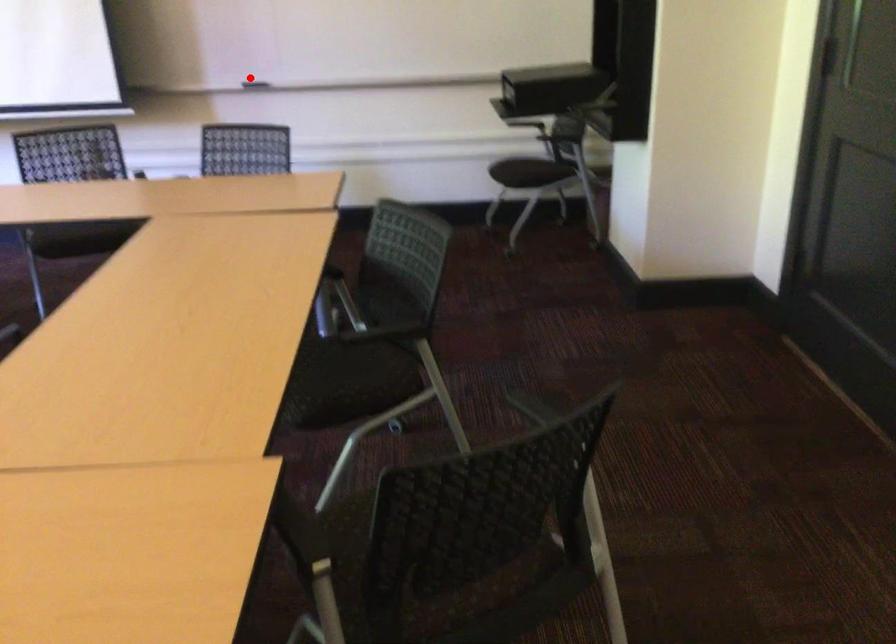
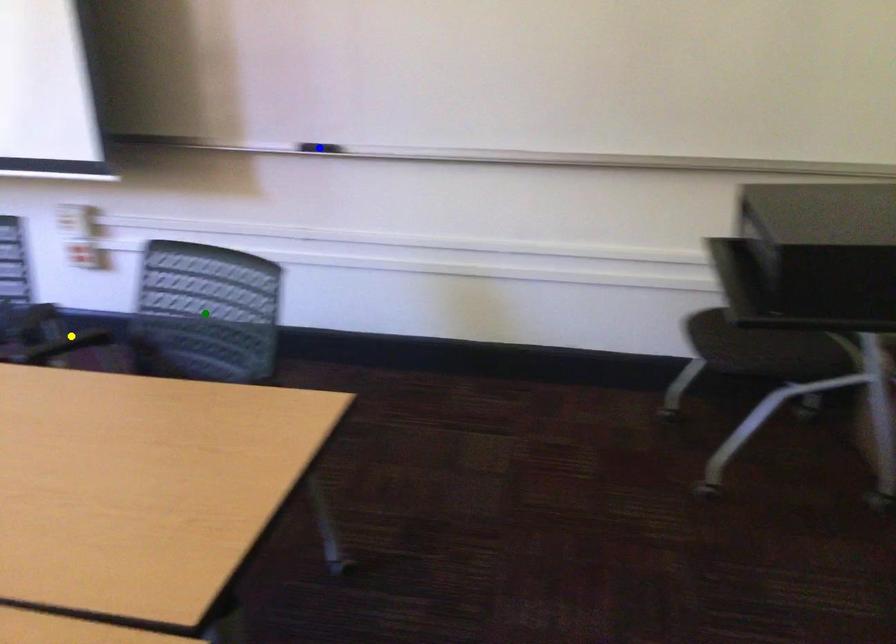
Question: I am providing you with two images of the same scene from different viewpoints. A red point is marked on the first image. You are given multiple points on the second image. In image 2, which mark is for the same physical point as the one in image 1?

Choices:
 (A) green point
 (B) yellow point
 (C) blue point

Answer: (C)